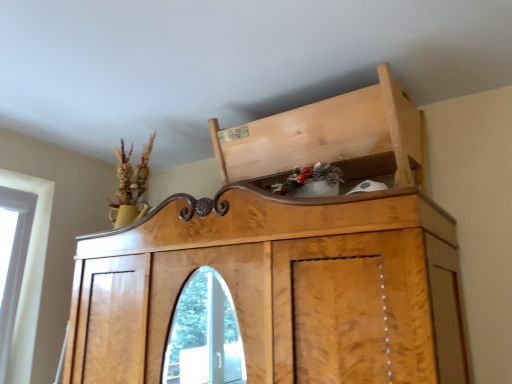
Question: Considering the relative positions of natural wood cabinet at upper center and wooden cabinet at upper center in the image provided, is natural wood cabinet at upper center in front of wooden cabinet at upper center?

Choices:
 (A) yes
 (B) no

Answer: (B)

Question: Is natural wood cabinet at upper center thinner than wooden cabinet at upper center?

Choices:
 (A) yes
 (B) no

Answer: (A)

Question: Is natural wood cabinet at upper center turned away from wooden cabinet at upper center?

Choices:
 (A) yes
 (B) no

Answer: (B)

Question: Are natural wood cabinet at upper center and wooden cabinet at upper center far apart?

Choices:
 (A) yes
 (B) no

Answer: (B)

Question: From the image's perspective, is natural wood cabinet at upper center beneath wooden cabinet at upper center?

Choices:
 (A) no
 (B) yes

Answer: (A)

Question: Considering the relative positions of natural wood cabinet at upper center and wooden cabinet at upper center in the image provided, is natural wood cabinet at upper center to the left of wooden cabinet at upper center from the viewer's perspective?

Choices:
 (A) yes
 (B) no

Answer: (B)

Question: From a real-world perspective, does wooden cabinet at upper center stand above natural wood cabinet at upper center?

Choices:
 (A) no
 (B) yes

Answer: (A)

Question: Does wooden cabinet at upper center come behind natural wood cabinet at upper center?

Choices:
 (A) yes
 (B) no

Answer: (B)

Question: From the image's perspective, is wooden cabinet at upper center above natural wood cabinet at upper center?

Choices:
 (A) yes
 (B) no

Answer: (B)

Question: From a real-world perspective, does wooden cabinet at upper center sit lower than natural wood cabinet at upper center?

Choices:
 (A) no
 (B) yes

Answer: (B)

Question: Is wooden cabinet at upper center at the left side of natural wood cabinet at upper center?

Choices:
 (A) yes
 (B) no

Answer: (A)

Question: Does wooden cabinet at upper center have a greater height compared to natural wood cabinet at upper center?

Choices:
 (A) no
 (B) yes

Answer: (B)

Question: From the image's perspective, is wooden cabinet at upper center above or below natural wood cabinet at upper center?

Choices:
 (A) below
 (B) above

Answer: (A)